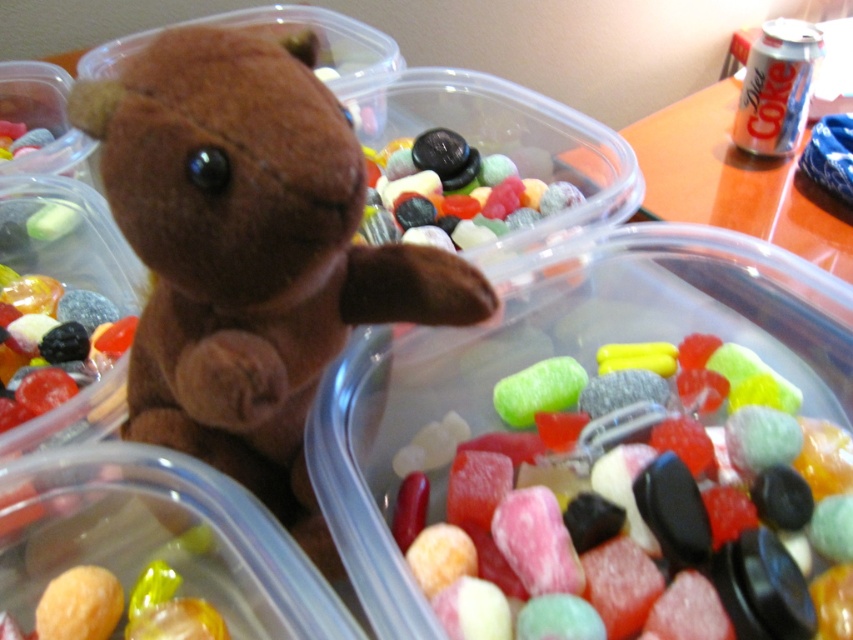
Question: Which point is closer to the camera taking this photo?

Choices:
 (A) (463, 305)
 (B) (532, 579)
 (C) (497, 224)

Answer: (B)

Question: Considering the relative positions of brown plush toy at center and black rubber candy at center in the image provided, where is brown plush toy at center located with respect to black rubber candy at center?

Choices:
 (A) right
 (B) left

Answer: (A)

Question: Is brown plush toy at center thinner than black rubber candy at center?

Choices:
 (A) yes
 (B) no

Answer: (B)

Question: Which point is farther to the camera?

Choices:
 (A) gummy candy at center
 (B) brown plush toy at center
 (C) black rubber candy at center
 (D) glossy black rock at center

Answer: (D)

Question: Can you confirm if brown plush toy at center is wider than glossy black rock at center?

Choices:
 (A) no
 (B) yes

Answer: (B)

Question: Which point is farther to the camera?

Choices:
 (A) (198, 240)
 (B) (523, 515)

Answer: (B)